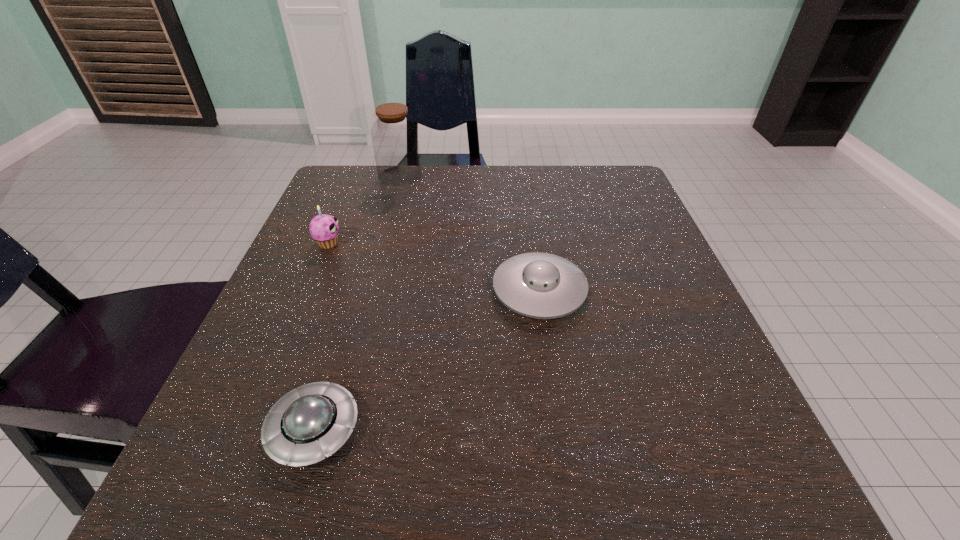
At what (x,y) coordinates should I click in order to perform the action: click on free region at the near edge of the desktop. Please return your answer as a coordinate pair (x, y). Image resolution: width=960 pixels, height=540 pixels. Looking at the image, I should click on (340, 456).

The width and height of the screenshot is (960, 540). What are the coordinates of `free space at the left edge` in the screenshot? It's located at (295, 372).

Image resolution: width=960 pixels, height=540 pixels. Find the location of `free location at the right edge`. free location at the right edge is located at coordinates (691, 368).

Where is `vacant space at the far left corner`? vacant space at the far left corner is located at coordinates (393, 193).

Image resolution: width=960 pixels, height=540 pixels. Find the location of `free space at the near left corner of the desktop`. free space at the near left corner of the desktop is located at coordinates (235, 444).

Identify the location of vacant area at the far right corner of the desktop. Image resolution: width=960 pixels, height=540 pixels. (597, 180).

Locate an element on the screen. The image size is (960, 540). empty space that is in between the right saucer and the tallest object is located at coordinates (469, 233).

Find the location of a particular element. vacant space that's between the third farthest object and the third nearest object is located at coordinates (434, 267).

I want to click on free space between the nearer saucer and the farther saucer, so pos(426,360).

Identify the location of free space that is in between the third shortest object and the second nearest object. (434, 267).